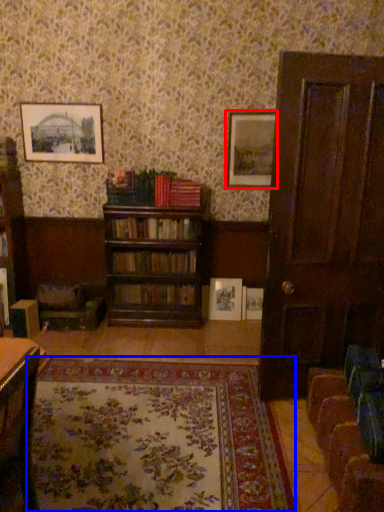
Question: Which of the following is the farthest to the observer, picture frame (highlighted by a red box) or blanket (highlighted by a blue box)?

Choices:
 (A) picture frame
 (B) blanket

Answer: (A)